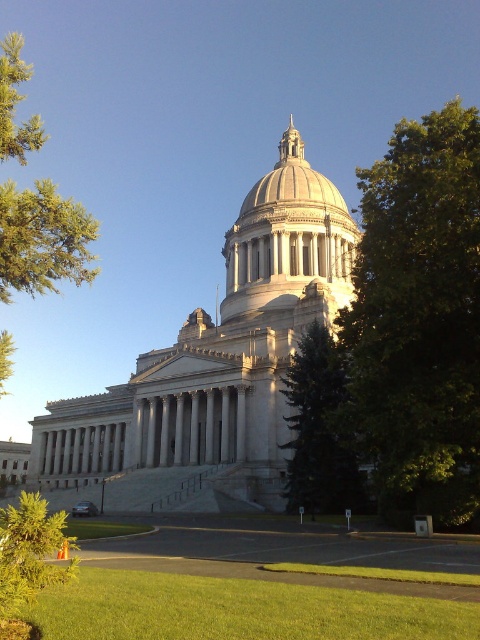
Question: Can you confirm if green leafy tree at right is smaller than green textured tree at lower left?

Choices:
 (A) no
 (B) yes

Answer: (A)

Question: Based on their relative distances, which object is nearer to the green leafy tree at left?

Choices:
 (A) green leafy tree at right
 (B) green textured tree at center
 (C) green leafy tree at lower left
 (D) green grass at lower center

Answer: (C)

Question: Which object is closer to the camera taking this photo?

Choices:
 (A) green grass at lower center
 (B) green leafy tree at lower left

Answer: (A)

Question: Does green textured tree at lower left appear on the left side of matte gray dome at center?

Choices:
 (A) no
 (B) yes

Answer: (B)

Question: Considering the relative positions of green grass at lower center and green leafy tree at lower left in the image provided, where is green grass at lower center located with respect to green leafy tree at lower left?

Choices:
 (A) right
 (B) left

Answer: (A)

Question: Which of these objects is positioned closest to the matte gray dome at center?

Choices:
 (A) green leafy tree at right
 (B) green grass at lower center
 (C) green textured tree at center

Answer: (C)